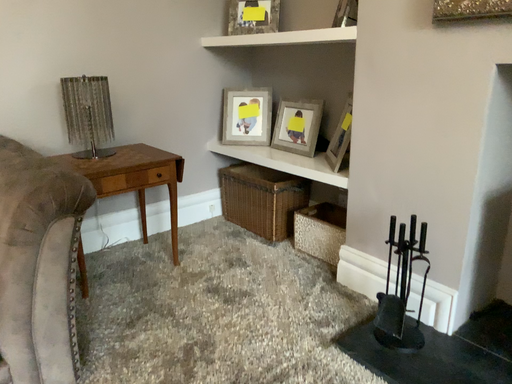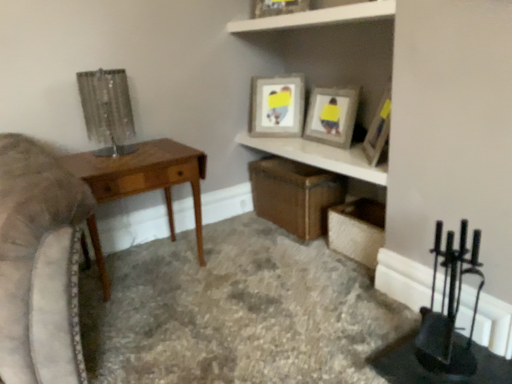
Question: How did the camera likely rotate when shooting the video?

Choices:
 (A) rotated left
 (B) rotated right

Answer: (A)